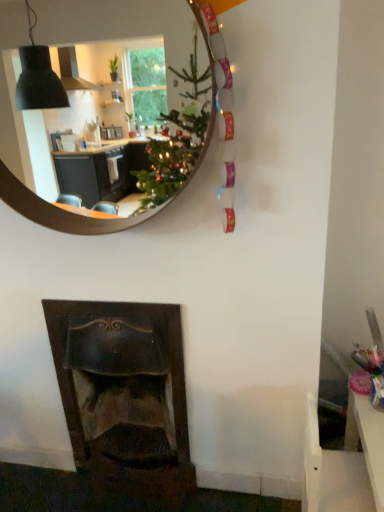
What is the approximate height of dark wood fireplace at lower left?

dark wood fireplace at lower left is 32.26 inches tall.

What is the approximate width of dark wood fireplace at lower left?

dark wood fireplace at lower left is 28.37 centimeters wide.

Locate an element on the screen. white plastic table at lower right is located at coordinates (367, 440).

Where is `dark wood fireplace at lower left`? dark wood fireplace at lower left is located at coordinates (119, 316).

Is dark wood fireplace at lower left at the right side of white plastic table at lower right?

No.

Can you confirm if dark wood fireplace at lower left is wider than white plastic table at lower right?

Indeed, dark wood fireplace at lower left has a greater width compared to white plastic table at lower right.

Do you think dark wood fireplace at lower left is within white plastic table at lower right, or outside of it?

dark wood fireplace at lower left is not enclosed by white plastic table at lower right.

From a real-world perspective, who is located lower, dark wood fireplace at lower left or white plastic table at lower right?

white plastic table at lower right, from a real-world perspective.

Which is more to the right, wooden mirror at upper center or dark wood fireplace at lower left?

dark wood fireplace at lower left.

Is wooden mirror at upper center not inside dark wood fireplace at lower left?

Indeed, wooden mirror at upper center is completely outside dark wood fireplace at lower left.

Which is behind, point (176, 16) or point (57, 341)?

Point (176, 16)

Considering the relative sizes of wooden mirror at upper center and dark wood fireplace at lower left in the image provided, is wooden mirror at upper center taller than dark wood fireplace at lower left?

Incorrect, the height of wooden mirror at upper center is not larger of that of dark wood fireplace at lower left.

Considering the relative sizes of white plastic table at lower right and wooden mirror at upper center in the image provided, is white plastic table at lower right thinner than wooden mirror at upper center?

Incorrect, the width of white plastic table at lower right is not less than that of wooden mirror at upper center.

Is white plastic table at lower right bigger than wooden mirror at upper center?

Yes.

Would you say wooden mirror at upper center is part of white plastic table at lower right's contents?

No, white plastic table at lower right does not contain wooden mirror at upper center.

Which point is more distant from viewer, (359, 431) or (45, 133)?

The point (45, 133) is farther.

From the image's perspective, which one is positioned higher, dark wood fireplace at lower left or wooden mirror at upper center?

wooden mirror at upper center, from the image's perspective.

Consider the image. Considering the positions of objects dark wood fireplace at lower left and wooden mirror at upper center in the image provided, who is in front, dark wood fireplace at lower left or wooden mirror at upper center?

wooden mirror at upper center is more forward.

Which of these two, dark wood fireplace at lower left or wooden mirror at upper center, stands taller?

dark wood fireplace at lower left.

Is wooden mirror at upper center at the back of dark wood fireplace at lower left?

No, dark wood fireplace at lower left is not facing away from wooden mirror at upper center.

Based on the photo, would you consider wooden mirror at upper center to be distant from white plastic table at lower right?

Yes, wooden mirror at upper center and white plastic table at lower right are located far from each other.

Does wooden mirror at upper center have a lesser height compared to white plastic table at lower right?

Incorrect, the height of wooden mirror at upper center does not fall short of that of white plastic table at lower right.

From a real-world perspective, is wooden mirror at upper center on top of white plastic table at lower right?

Correct, in the physical world, wooden mirror at upper center is higher than white plastic table at lower right.

Is white plastic table at lower right not close to dark wood fireplace at lower left?

white plastic table at lower right is near dark wood fireplace at lower left, not far away.

From a real-world perspective, is white plastic table at lower right below dark wood fireplace at lower left?

Yes, from a real-world perspective, white plastic table at lower right is beneath dark wood fireplace at lower left.

Which object is closer to the camera, white plastic table at lower right or dark wood fireplace at lower left?

white plastic table at lower right is more forward.

Consider the image. Is white plastic table at lower right to the left of dark wood fireplace at lower left from the viewer's perspective?

In fact, white plastic table at lower right is to the right of dark wood fireplace at lower left.

At what (x,y) coordinates should I click in order to perform the action: click on fireplace above the white plastic table at lower right (from a real-world perspective). Please return your answer as a coordinate pair (x, y). The width and height of the screenshot is (384, 512). Looking at the image, I should click on (119, 316).

Where is `fireplace lying on the right of wooden mirror at upper center`? This screenshot has height=512, width=384. fireplace lying on the right of wooden mirror at upper center is located at coordinates (119, 316).

Looking at the image, which one is located further to dark wood fireplace at lower left, wooden mirror at upper center or white plastic table at lower right?

Among the two, wooden mirror at upper center is located further to dark wood fireplace at lower left.

Estimate the real-world distances between objects in this image. Which object is further from white plastic table at lower right, dark wood fireplace at lower left or wooden mirror at upper center?

wooden mirror at upper center is positioned further to the anchor white plastic table at lower right.

Which object lies further to the anchor point dark wood fireplace at lower left, white plastic table at lower right or wooden mirror at upper center?

Among the two, wooden mirror at upper center is located further to dark wood fireplace at lower left.

Considering their positions, is dark wood fireplace at lower left positioned closer to wooden mirror at upper center than white plastic table at lower right?

dark wood fireplace at lower left.

Which object lies further to the anchor point white plastic table at lower right, wooden mirror at upper center or dark wood fireplace at lower left?

Among the two, wooden mirror at upper center is located further to white plastic table at lower right.

Looking at the image, which one is located further to wooden mirror at upper center, white plastic table at lower right or dark wood fireplace at lower left?

white plastic table at lower right is positioned further to the anchor wooden mirror at upper center.

At what (x,y) coordinates should I click in order to perform the action: click on fireplace between wooden mirror at upper center and white plastic table at lower right in the up-down direction. Please return your answer as a coordinate pair (x, y). The height and width of the screenshot is (512, 384). Looking at the image, I should click on (119, 316).